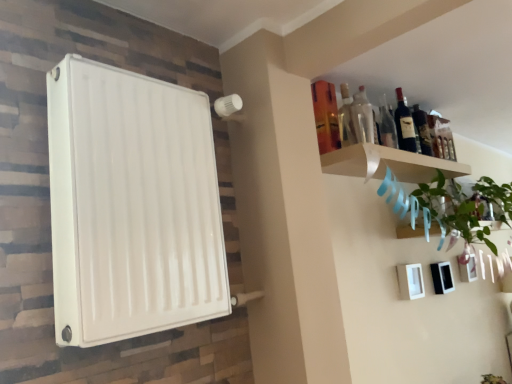
Question: From the image's perspective, is green leafy plant at upper right located beneath white wood shelf at upper right?

Choices:
 (A) yes
 (B) no

Answer: (A)

Question: Does green leafy plant at upper right appear on the left side of white wood shelf at upper right?

Choices:
 (A) no
 (B) yes

Answer: (A)

Question: Considering the relative positions of green leafy plant at upper right and white wood shelf at upper right in the image provided, is green leafy plant at upper right to the right of white wood shelf at upper right from the viewer's perspective?

Choices:
 (A) no
 (B) yes

Answer: (B)

Question: Would you say green leafy plant at upper right contains white wood shelf at upper right?

Choices:
 (A) yes
 (B) no

Answer: (B)

Question: Is green leafy plant at upper right facing away from white wood shelf at upper right?

Choices:
 (A) no
 (B) yes

Answer: (A)

Question: Is green leafy plant at upper right positioned behind white wood shelf at upper right?

Choices:
 (A) no
 (B) yes

Answer: (B)

Question: Is transparent glass bottle at upper right, positioned as the 4th bottle in right-to-left order, oriented away from white matte picture frame at lower right?

Choices:
 (A) yes
 (B) no

Answer: (B)

Question: From a real-world perspective, is transparent glass bottle at upper right, positioned as the 4th bottle in right-to-left order, positioned under white matte picture frame at lower right based on gravity?

Choices:
 (A) no
 (B) yes

Answer: (A)

Question: Considering the relative sizes of transparent glass bottle at upper right, marked as the first bottle in a left-to-right arrangement, and white matte picture frame at lower right in the image provided, is transparent glass bottle at upper right, marked as the first bottle in a left-to-right arrangement, smaller than white matte picture frame at lower right?

Choices:
 (A) yes
 (B) no

Answer: (A)

Question: Does transparent glass bottle at upper right, marked as the 1th bottle in a front-to-back arrangement, have a greater height compared to white matte picture frame at lower right?

Choices:
 (A) no
 (B) yes

Answer: (B)

Question: Is transparent glass bottle at upper right, marked as the 1th bottle in a front-to-back arrangement, positioned far away from white matte picture frame at lower right?

Choices:
 (A) yes
 (B) no

Answer: (B)

Question: Is transparent glass bottle at upper right, marked as the 1th bottle in a front-to-back arrangement, wider than white matte picture frame at lower right?

Choices:
 (A) yes
 (B) no

Answer: (B)

Question: Would you say white matte picture frame at lower right is part of dark glass bottle at upper right, which is the fourth bottle in front-to-back order,'s contents?

Choices:
 (A) no
 (B) yes

Answer: (A)